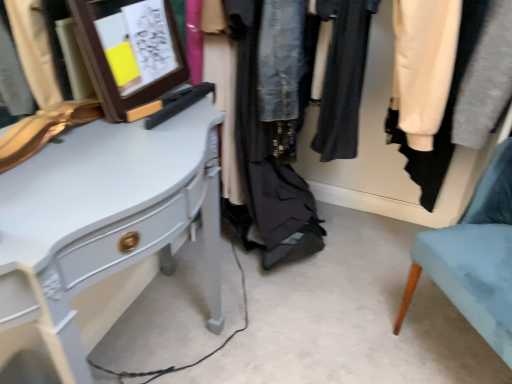
What are the coordinates of `vacant space underneath light blue fabric chair at lower right (from a real-world perspective)` in the screenshot? It's located at (451, 353).